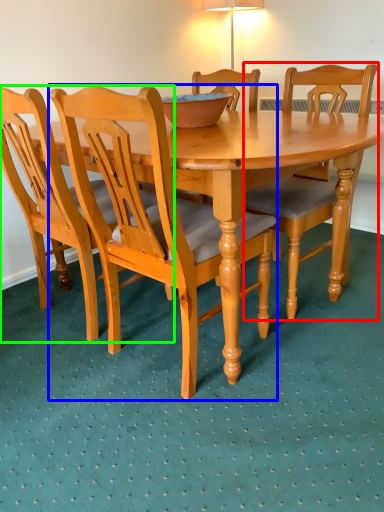
Question: Which object is positioned closest to chair (highlighted by a red box)? Select from chair (highlighted by a blue box) and chair (highlighted by a green box).

Choices:
 (A) chair
 (B) chair

Answer: (A)